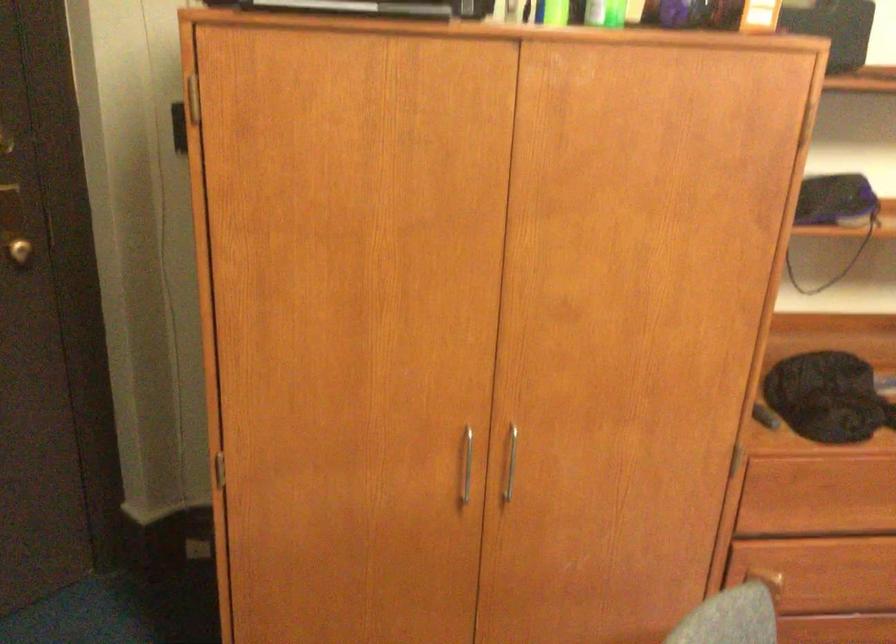
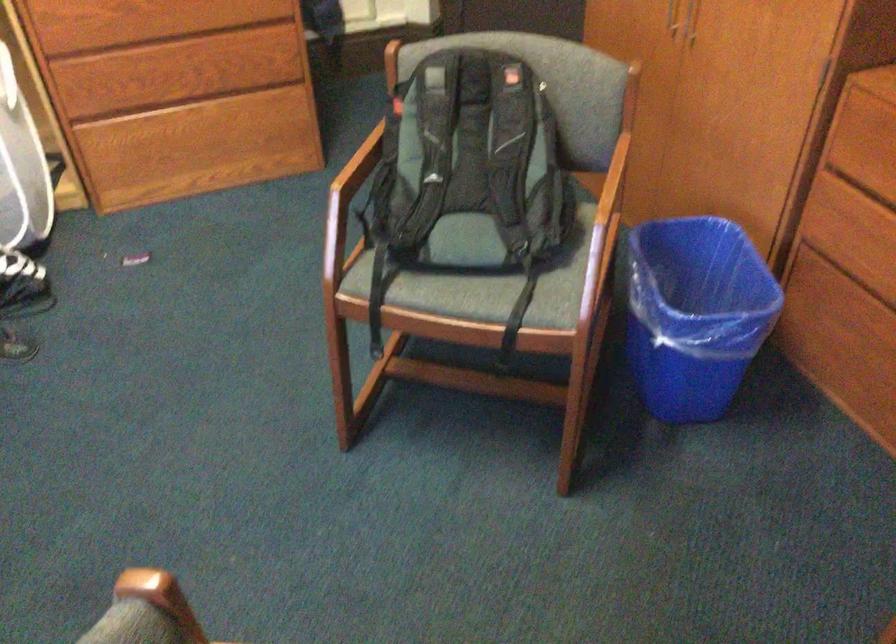
Where in the second image is the point corresponding to (503,473) from the first image?

(691, 21)